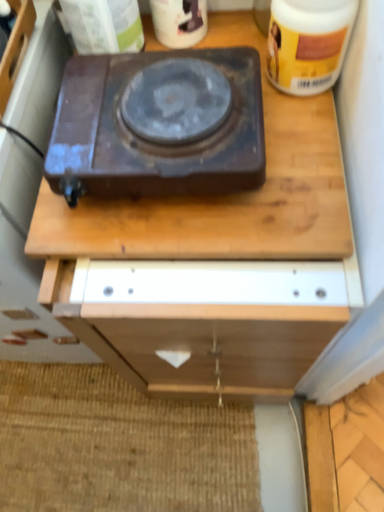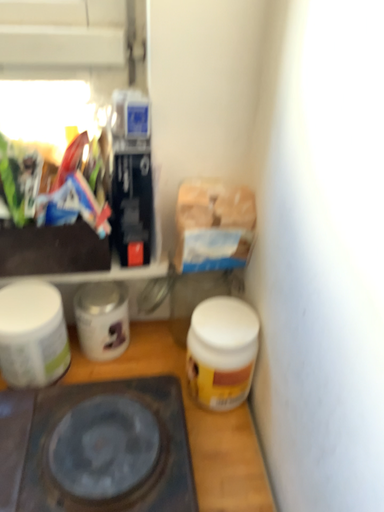
Question: How did the camera likely rotate when shooting the video?

Choices:
 (A) rotated upward
 (B) rotated downward

Answer: (A)